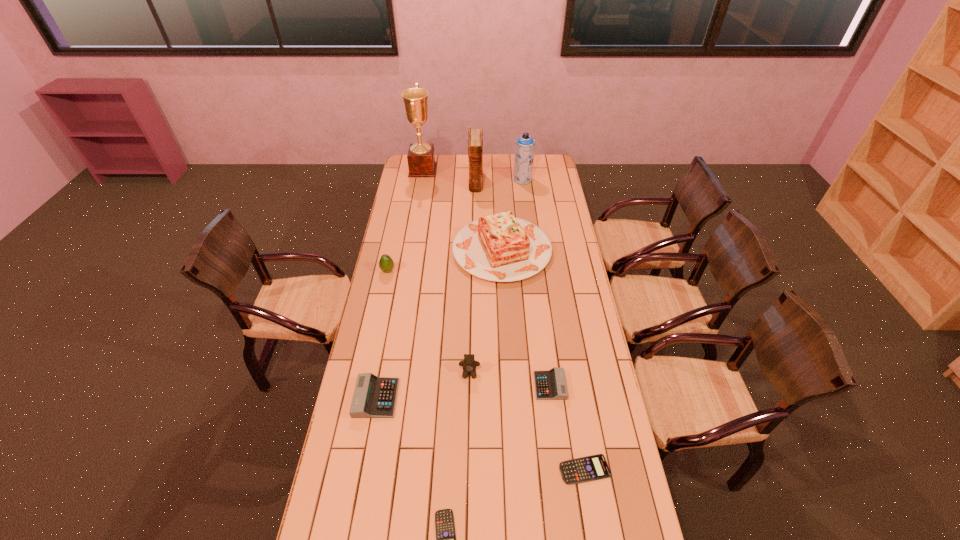
Where is `trophy cup`? trophy cup is located at coordinates (421, 157).

The width and height of the screenshot is (960, 540). In order to click on hardback book in this screenshot , I will do `click(475, 142)`.

Where is `blue aerosol can`? blue aerosol can is located at coordinates (525, 145).

Identify the location of orange lasagna. This screenshot has width=960, height=540. (500, 247).

This screenshot has height=540, width=960. I want to click on the fourth tallest object, so click(x=500, y=247).

The image size is (960, 540). I want to click on avocado, so click(386, 264).

Locate an element on the screen. brown teddy bear is located at coordinates (469, 364).

What are the coordinates of `the bigger gray calculator` in the screenshot? It's located at (374, 397).

I want to click on the seventh tallest object, so click(x=374, y=397).

Identify the location of the smaller gray calculator. Image resolution: width=960 pixels, height=540 pixels. (549, 385).